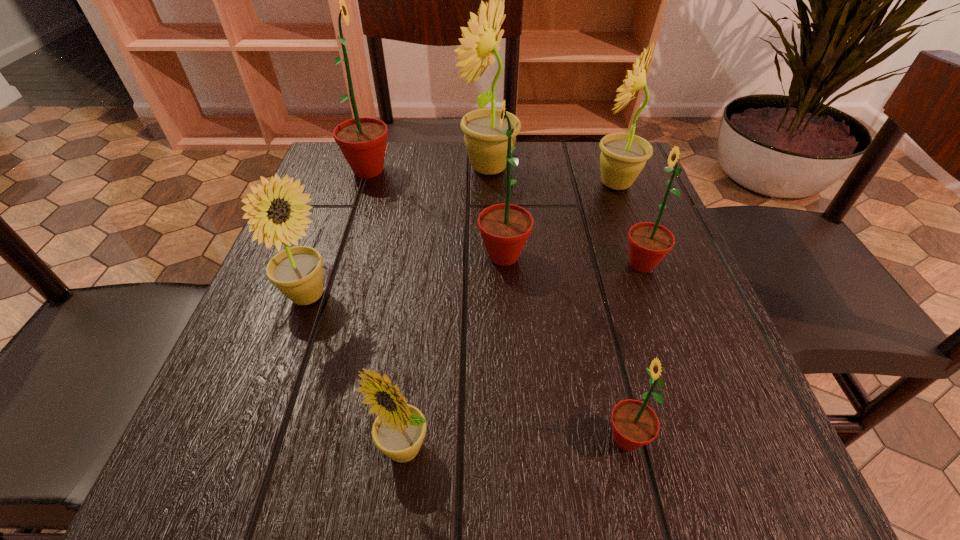
You are a GUI agent. You are given a task and a screenshot of the screen. Output one action in this format:
    pyautogui.click(x=<x>, y=<y>)
    Task: Click on the vacant space located on the face of the third smallest green sunflower
    The height and width of the screenshot is (540, 960).
    Given the screenshot: What is the action you would take?
    click(x=354, y=255)

I want to click on vacant region located 0.210m on the face of the third smallest green sunflower, so click(x=366, y=255).

Identify the location of blank space located 0.240m on the face of the second smallest yellow sunflower. This screenshot has width=960, height=540. (475, 297).

Find the location of `free region located on the face of the second smallest green sunflower`. free region located on the face of the second smallest green sunflower is located at coordinates (424, 264).

Image resolution: width=960 pixels, height=540 pixels. Find the location of `vacant space located on the face of the second smallest green sunflower`. vacant space located on the face of the second smallest green sunflower is located at coordinates (512, 264).

The image size is (960, 540). In order to click on free region located 0.340m on the face of the second smallest green sunflower in this screenshot , I will do `click(435, 264)`.

The image size is (960, 540). What are the coordinates of `vacant space located 0.210m on the face of the third sunflower from right to left` in the screenshot? It's located at (444, 438).

Identify the location of free space located on the face of the third sunflower from right to left. This screenshot has width=960, height=540. (559, 438).

Find the location of a particular element. This screenshot has width=960, height=540. vacant space located 0.070m on the face of the third sunflower from right to left is located at coordinates (551, 438).

Identify the location of object that is positioned at the far left corner. The height and width of the screenshot is (540, 960). (362, 141).